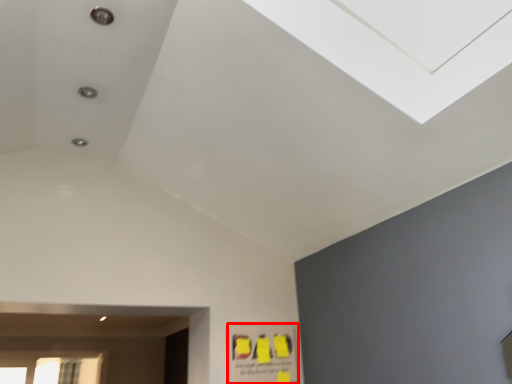
Question: Considering the relative positions of poster (annotated by the red box) and window in the image provided, where is poster (annotated by the red box) located with respect to the staircase?

Choices:
 (A) right
 (B) left

Answer: (A)